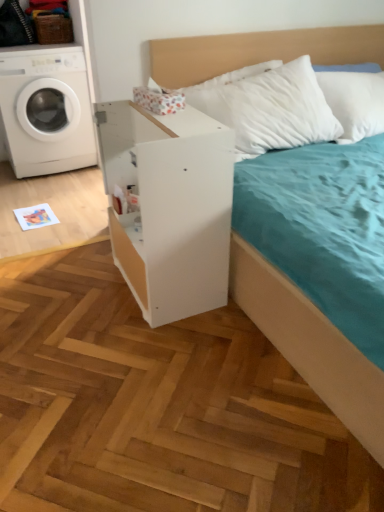
This screenshot has width=384, height=512. What do you see at coordinates (169, 206) in the screenshot? I see `white matte dresser at center` at bounding box center [169, 206].

Image resolution: width=384 pixels, height=512 pixels. I want to click on white matte dresser at center, so pyautogui.click(x=169, y=206).

What do you see at coordinates (46, 109) in the screenshot? I see `white glossy washing machine at left` at bounding box center [46, 109].

Find the location of `white glossy washing machine at left`. white glossy washing machine at left is located at coordinates (46, 109).

Identify the location of white matte dresser at center. (169, 206).

Considering the positions of objects white matte dresser at center and white glossy washing machine at left in the image provided, who is more to the right, white matte dresser at center or white glossy washing machine at left?

Positioned to the right is white matte dresser at center.

Which object is closer to the camera, white matte dresser at center or white glossy washing machine at left?

white matte dresser at center is closer to the camera.

Is point (158, 217) positioned before point (62, 132)?

Yes, point (158, 217) is in front of point (62, 132).

From the image's perspective, which one is positioned higher, white matte dresser at center or white glossy washing machine at left?

white glossy washing machine at left.

From a real-world perspective, is white matte dresser at center beneath white glossy washing machine at left?

Correct, in the physical world, white matte dresser at center is lower than white glossy washing machine at left.

Considering the relative sizes of white matte dresser at center and white glossy washing machine at left in the image provided, is white matte dresser at center wider than white glossy washing machine at left?

In fact, white matte dresser at center might be narrower than white glossy washing machine at left.

Who is taller, white matte dresser at center or white glossy washing machine at left?

Standing taller between the two is white glossy washing machine at left.

Consider the image. Which of these two, white matte dresser at center or white glossy washing machine at left, is bigger?

With larger size is white glossy washing machine at left.

Is white matte dresser at center situated inside white glossy washing machine at left or outside?

white matte dresser at center is not inside white glossy washing machine at left, it's outside.

Is white matte dresser at center far away from white glossy washing machine at left?

That's right, there is a large distance between white matte dresser at center and white glossy washing machine at left.

Is white matte dresser at center looking in the opposite direction of white glossy washing machine at left?

No, white matte dresser at center's orientation is not away from white glossy washing machine at left.

Measure the distance between white matte dresser at center and white glossy washing machine at left.

white matte dresser at center and white glossy washing machine at left are 4.62 feet apart from each other.

Find the location of a particular element. The width and height of the screenshot is (384, 512). dresser below the white glossy washing machine at left (from the image's perspective) is located at coordinates (169, 206).

Does white glossy washing machine at left appear on the left side of white matte dresser at center?

Indeed, white glossy washing machine at left is positioned on the left side of white matte dresser at center.

Which is behind, white glossy washing machine at left or white matte dresser at center?

Positioned behind is white glossy washing machine at left.

Which is in front, point (30, 115) or point (159, 159)?

Positioned in front is point (159, 159).

From the image's perspective, is white glossy washing machine at left located above white matte dresser at center?

Indeed, from the image's perspective, white glossy washing machine at left is shown above white matte dresser at center.

From a real-world perspective, is white glossy washing machine at left positioned above or below white matte dresser at center?

white glossy washing machine at left is above white matte dresser at center.

Considering the sizes of white glossy washing machine at left and white matte dresser at center in the image, is white glossy washing machine at left wider or thinner than white matte dresser at center?

In the image, white glossy washing machine at left appears to be wider than white matte dresser at center.

Considering the relative sizes of white glossy washing machine at left and white matte dresser at center in the image provided, is white glossy washing machine at left taller than white matte dresser at center?

Yes, white glossy washing machine at left is taller than white matte dresser at center.

Considering the sizes of white glossy washing machine at left and white matte dresser at center in the image, is white glossy washing machine at left bigger or smaller than white matte dresser at center?

Clearly, white glossy washing machine at left is larger in size than white matte dresser at center.

Is white glossy washing machine at left inside the boundaries of white matte dresser at center, or outside?

white glossy washing machine at left is located beyond the bounds of white matte dresser at center.

Is there a large distance between white glossy washing machine at left and white matte dresser at center?

That's right, there is a large distance between white glossy washing machine at left and white matte dresser at center.

Does white glossy washing machine at left turn towards white matte dresser at center?

Yes, white glossy washing machine at left is turned towards white matte dresser at center.

How different are the orientations of white glossy washing machine at left and white matte dresser at center in degrees?

The facing directions of white glossy washing machine at left and white matte dresser at center are 91.6 degrees apart.

Locate an element on the screen. The image size is (384, 512). dresser in front of the white glossy washing machine at left is located at coordinates (169, 206).

Locate an element on the screen. washing machine above the white matte dresser at center (from a real-world perspective) is located at coordinates (46, 109).

Identify the location of dresser on the right of white glossy washing machine at left. This screenshot has width=384, height=512. (169, 206).